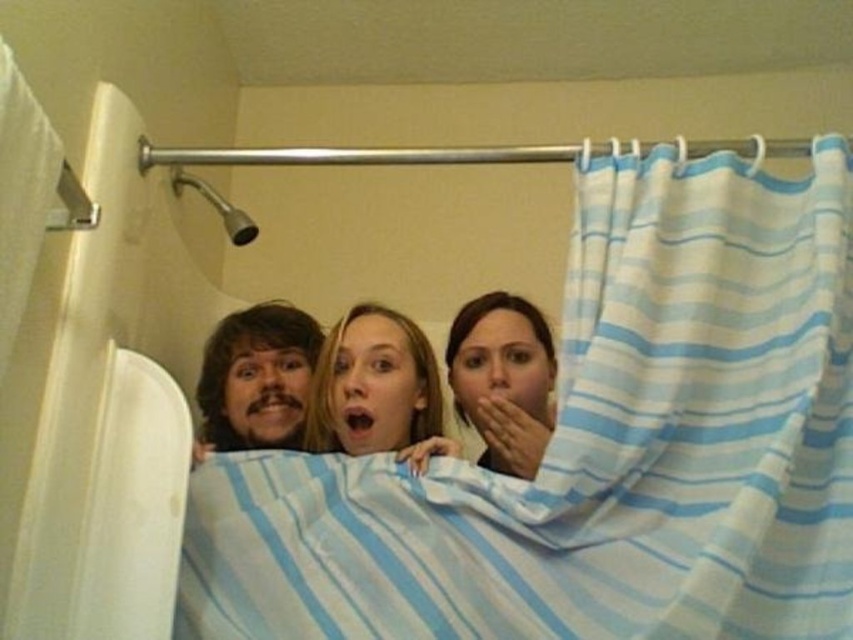
Does blue striped fabric at upper center come behind white striped shower curtain at left?

Yes, it is.

This screenshot has width=853, height=640. What do you see at coordinates (596, 449) in the screenshot? I see `blue striped fabric at upper center` at bounding box center [596, 449].

This screenshot has width=853, height=640. Find the location of `blue striped fabric at upper center`. blue striped fabric at upper center is located at coordinates (596, 449).

Between blue striped fabric at upper center and shaggy brown hair at center, which one is positioned lower?

blue striped fabric at upper center is below.

Is point (560, 632) positioned after point (310, 346)?

No, it is in front of (310, 346).

Locate an element on the screen. The height and width of the screenshot is (640, 853). blue striped fabric at upper center is located at coordinates (596, 449).

Which is more to the right, shaggy brown hair at center or brushed metal shower head at upper center?

From the viewer's perspective, shaggy brown hair at center appears more on the right side.

Is shaggy brown hair at center positioned before brushed metal shower head at upper center?

Yes, shaggy brown hair at center is in front of brushed metal shower head at upper center.

Is point (291, 413) farther from viewer compared to point (190, 186)?

No, (291, 413) is in front of (190, 186).

In order to click on shaggy brown hair at center in this screenshot , I will do `click(256, 380)`.